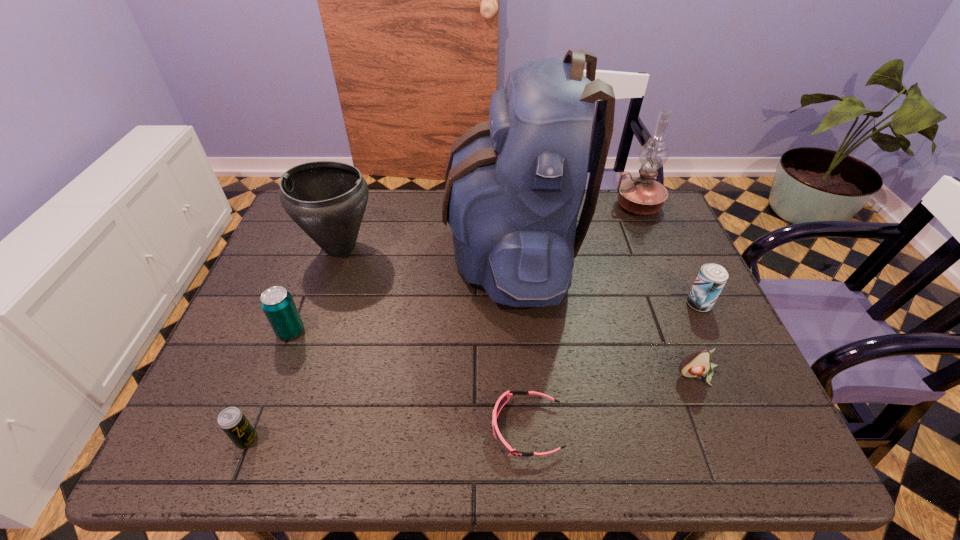
The image size is (960, 540). I want to click on backpack, so click(514, 185).

The image size is (960, 540). Identify the location of the second tallest object. (641, 195).

The width and height of the screenshot is (960, 540). Identify the location of the sixth shortest object. (327, 199).

Where is `the second nearest beer can`? This screenshot has height=540, width=960. the second nearest beer can is located at coordinates (277, 303).

You are a GUI agent. You are given a task and a screenshot of the screen. Output one action in this format:
    pyautogui.click(x=<x>, y=<y>)
    Task: Click on the rightmost beer can
    This screenshot has height=540, width=960.
    Given the screenshot: What is the action you would take?
    pos(711,279)

Image resolution: width=960 pixels, height=540 pixels. I want to click on the sixth farthest object, so click(696, 364).

Where is `the shortest beer can`? This screenshot has width=960, height=540. the shortest beer can is located at coordinates (232, 421).

Identify the location of goggles. (504, 398).

Locate an element on the screen. This screenshot has width=960, height=540. vacant space located 0.170m at the front pocket of the backpack is located at coordinates (389, 249).

Locate an element on the screen. This screenshot has height=540, width=960. vacant space located at the front pocket of the backpack is located at coordinates (410, 249).